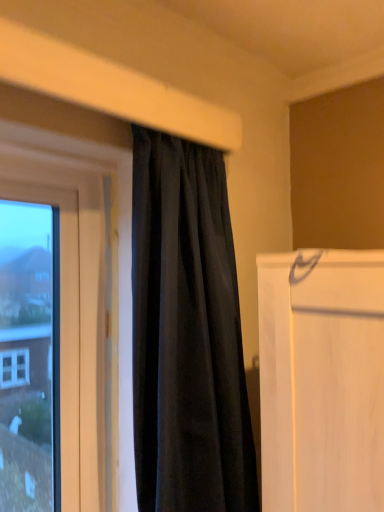
Describe the element at coordinates (187, 334) in the screenshot. I see `black velvet curtain at upper center` at that location.

Find the location of a particular element. The width and height of the screenshot is (384, 512). black velvet curtain at upper center is located at coordinates (187, 334).

The width and height of the screenshot is (384, 512). In order to click on black velvet curtain at upper center in this screenshot , I will do `click(187, 334)`.